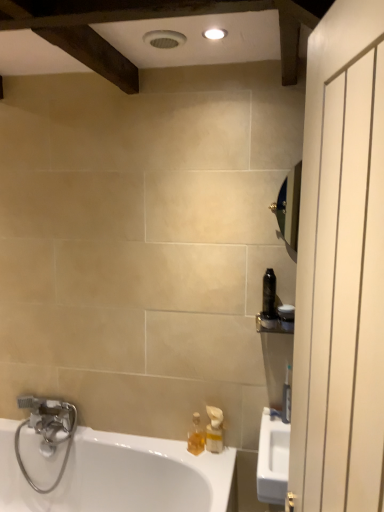
Locate an element on the screen. vacant area in front of translucent plastic soap dispenser at lower center, placed as the first soap dispenser when sorted from right to left is located at coordinates point(218,469).